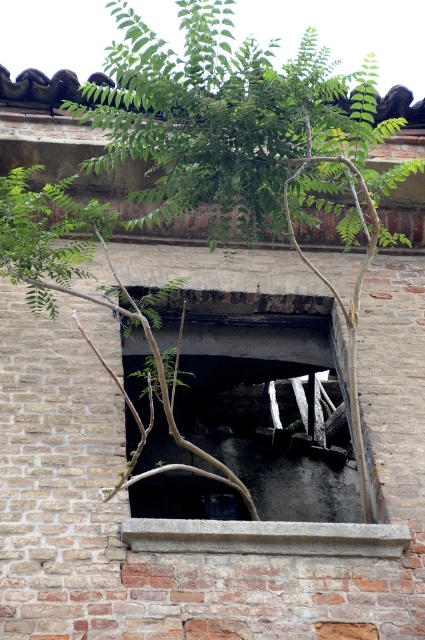
You are a firefighter assessing a building fire. You see a brick wall with a partially open window. There is a point marked at coordinates (257, 404). What does this point represent?

The point at coordinates (257, 404) represents a charcoal ash hole at the center of the brick wall.

You are a maintenance worker inspecting the brick wall. You notice the charcoal ash hole at center and the gray concrete ledge at center. Which object is located above the other?

The charcoal ash hole at center is positioned over the gray concrete ledge at center, so it is above the ledge.